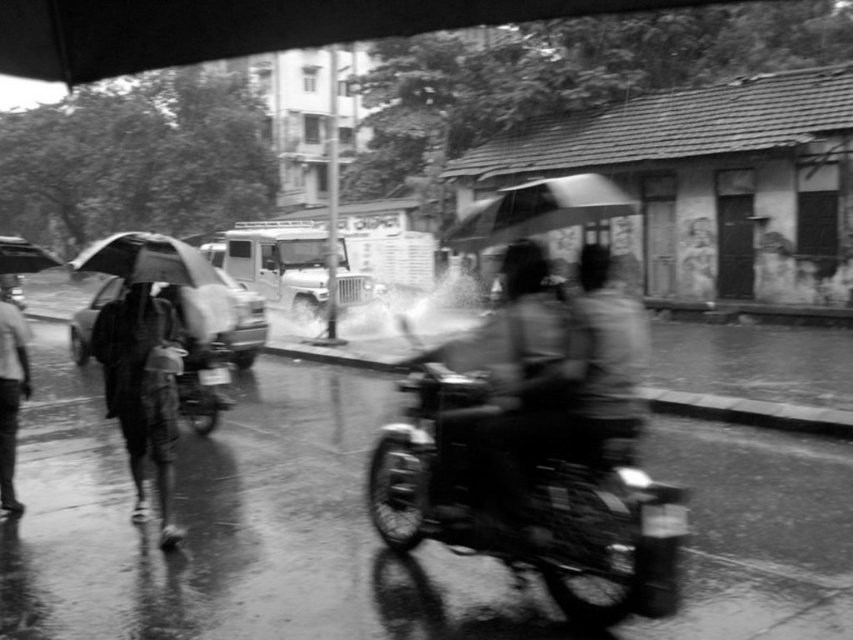
Is smooth black motorcycle at center above dark fabric umbrella at left?

Indeed, smooth black motorcycle at center is positioned over dark fabric umbrella at left.

What do you see at coordinates (502, 396) in the screenshot? I see `smooth black motorcycle at center` at bounding box center [502, 396].

Locate an element on the screen. smooth black motorcycle at center is located at coordinates (502, 396).

Identify the location of dark matte umbrella at left. (146, 259).

Which is below, dark matte umbrella at left or transparent plastic umbrella at upper left?

Positioned lower is transparent plastic umbrella at upper left.

Identify the location of dark matte umbrella at left. (146, 259).

Where is `transparent plastic umbrella at center`? transparent plastic umbrella at center is located at coordinates (537, 209).

Which is in front, point (532, 228) or point (109, 246)?

Point (532, 228) is in front.

Identify the location of transparent plastic umbrella at center. The width and height of the screenshot is (853, 640). (537, 209).